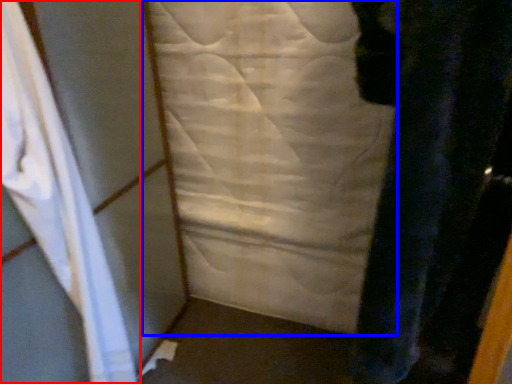
Question: Among these objects, which one is farthest to the camera, curtain (highlighted by a red box) or sheet (highlighted by a blue box)?

Choices:
 (A) curtain
 (B) sheet

Answer: (B)